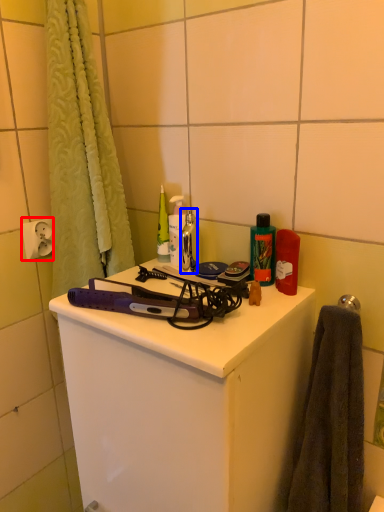
Question: Which point is closer to the camera, electric outlet (highlighted by a red box) or faucet (highlighted by a blue box)?

Choices:
 (A) electric outlet
 (B) faucet

Answer: (B)